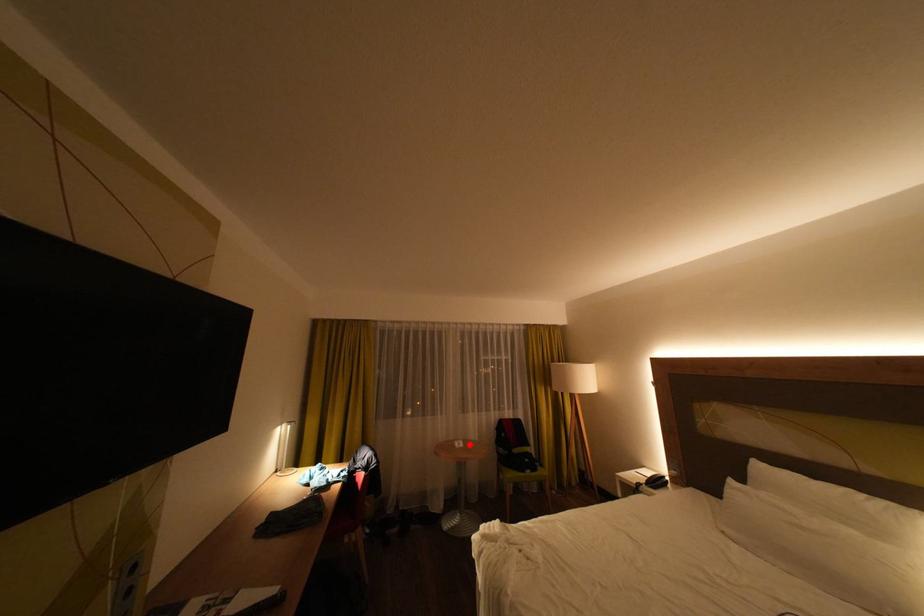
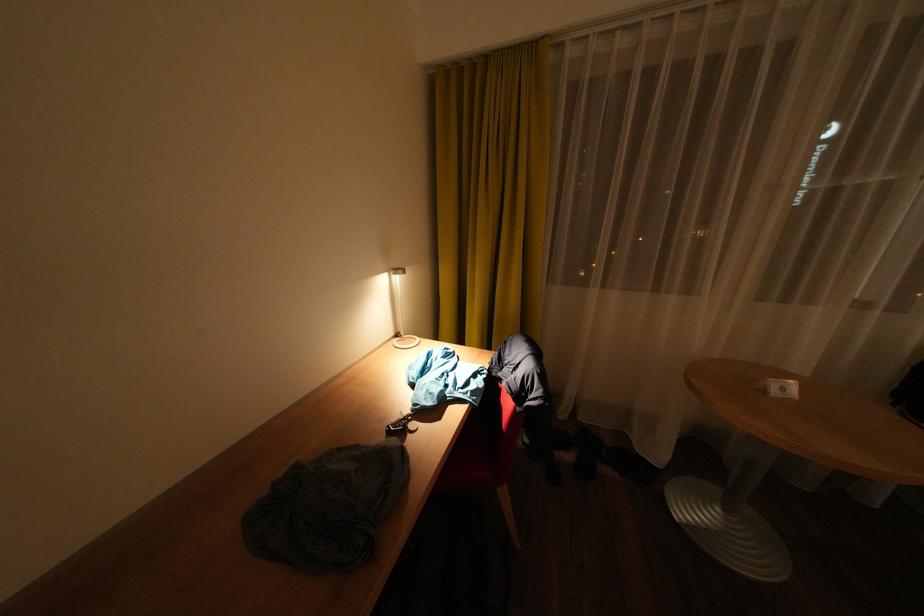
Where in the second image is the point corresponding to the highlighted location from the first image?

(794, 390)